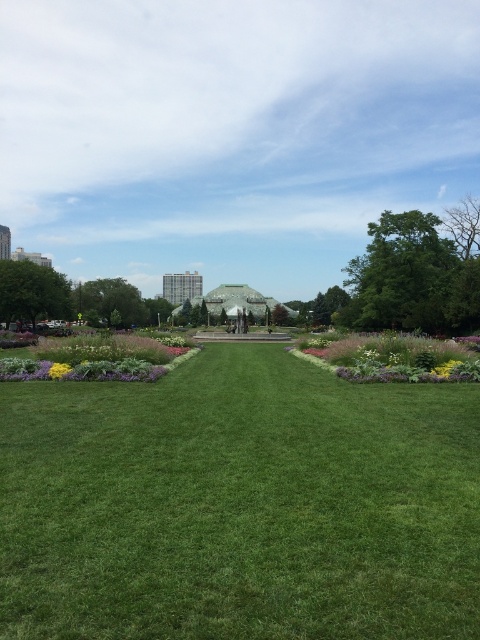
You are a gardener who wants to water the yellow matte flower at lower left and the yellow matte flower at center. Since you can only reach up to 1 meter, can you water both without moving your position?

The yellow matte flower at lower left is positioned under the yellow matte flower at center, so you can reach both as long as they are within your 1 meter reach.

You are standing at the entrance of the park and see the yellow matte flower at lower left and the yellow matte flower at center. Which one is positioned to the left of the other?

The yellow matte flower at lower left is to the left of the yellow matte flower at center.